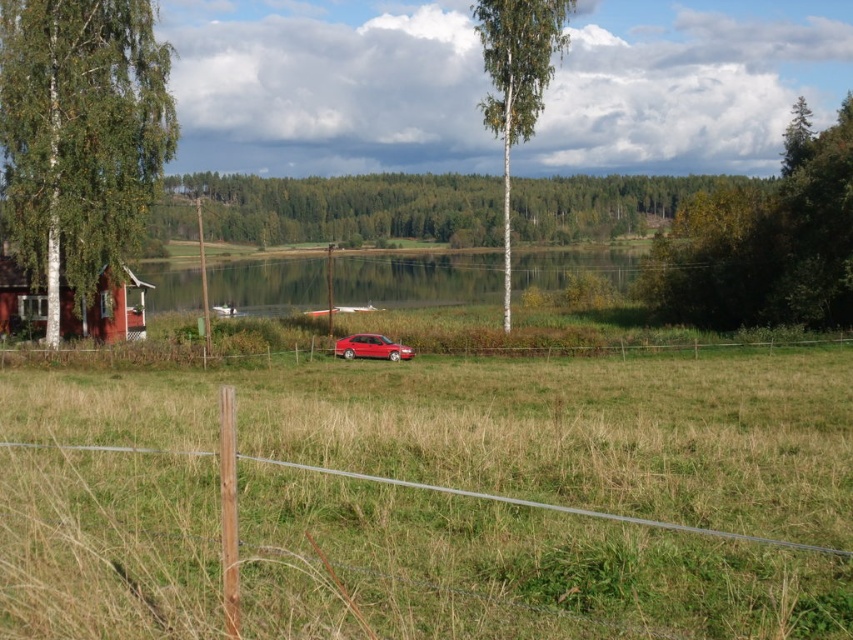
Question: Where is white bark birch tree at center located in relation to matte red wooden hut at left in the image?

Choices:
 (A) left
 (B) right

Answer: (B)

Question: Can you confirm if green leafy tree at center is bigger than matte red wooden hut at left?

Choices:
 (A) yes
 (B) no

Answer: (A)

Question: Which of the following is the farthest from the observer?

Choices:
 (A) green grass at center
 (B) white bark birch tree at center
 (C) green leafy tree at center

Answer: (C)

Question: Estimate the real-world distances between objects in this image. Which object is closer to the green leafy tree at center?

Choices:
 (A) matte red wooden hut at left
 (B) green grass at center
 (C) white bark tree at left

Answer: (A)

Question: Which of these objects is positioned closest to the shiny red sedan at center?

Choices:
 (A) white bark birch tree at center
 (B) clear water at center
 (C) matte red wooden hut at left
 (D) white bark tree at left

Answer: (D)

Question: Where is green leafy tree at right located in relation to matte red wooden hut at left in the image?

Choices:
 (A) above
 (B) below

Answer: (A)